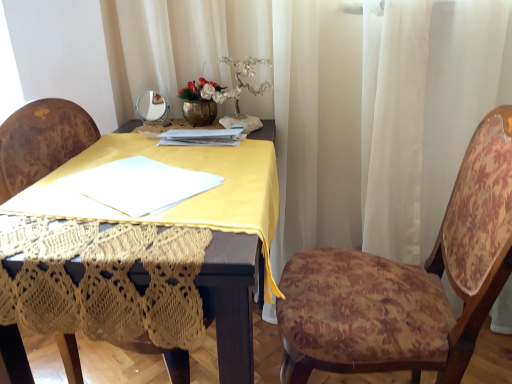
Question: Considering the positions of floral fabric chair at right, which is the 1th chair from right to left, and white sheer curtain at upper center in the image, is floral fabric chair at right, which is the 1th chair from right to left, bigger or smaller than white sheer curtain at upper center?

Choices:
 (A) big
 (B) small

Answer: (B)

Question: From the image's perspective, is floral fabric chair at right, the 2th chair positioned from the left, located above or below white sheer curtain at upper center?

Choices:
 (A) above
 (B) below

Answer: (B)

Question: Which object is the farthest from the floral fabric chair at right, which is the 1th chair from right to left?

Choices:
 (A) white sheer curtain at upper center
 (B) velvet floral chair at center, positioned as the 1th chair in left-to-right order

Answer: (B)

Question: Which of these objects is positioned farthest from the velvet floral chair at center, positioned as the 1th chair in left-to-right order?

Choices:
 (A) white sheer curtain at upper center
 (B) floral fabric chair at right, which is the 1th chair from right to left

Answer: (B)